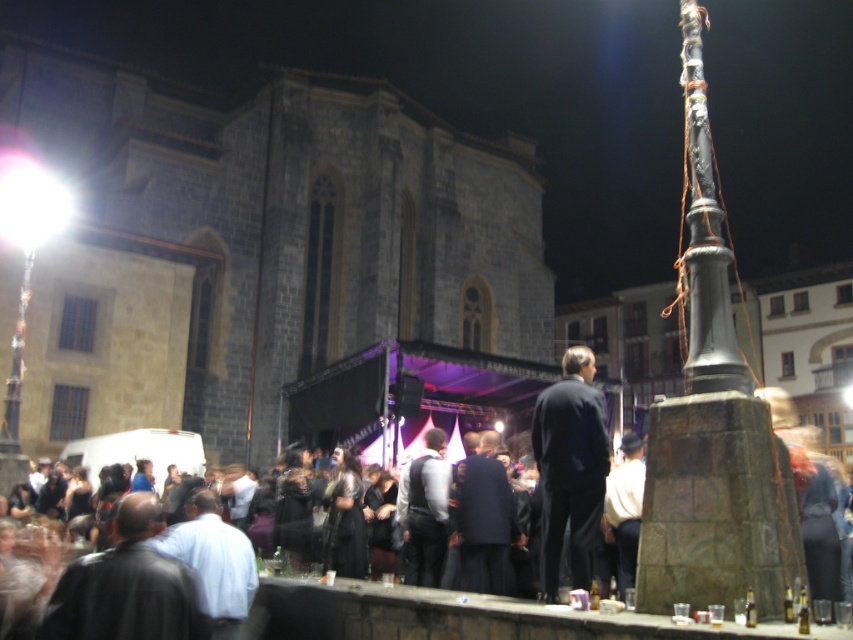
Who is positioned more to the right, black leather jacket at lower left or white cotton shirt at center?

Positioned to the right is white cotton shirt at center.

From the picture: Who is more distant from viewer, (108, 570) or (616, 515)?

Point (616, 515)

This screenshot has height=640, width=853. I want to click on black leather jacket at lower left, so click(x=126, y=588).

Who is lower down, dark gray stone church at upper left or white cotton shirt at center?

white cotton shirt at center is below.

Is dark gray stone church at upper left positioned in front of white cotton shirt at center?

No, it is not.

Is point (242, 140) in front of point (619, 534)?

That is False.

Image resolution: width=853 pixels, height=640 pixels. Identify the location of dark gray stone church at upper left. (264, 241).

Describe the element at coordinates (264, 241) in the screenshot. I see `dark gray stone church at upper left` at that location.

Describe the element at coordinates (264, 241) in the screenshot. I see `dark gray stone church at upper left` at that location.

Where is `dark gray stone church at upper left`? The width and height of the screenshot is (853, 640). dark gray stone church at upper left is located at coordinates (264, 241).